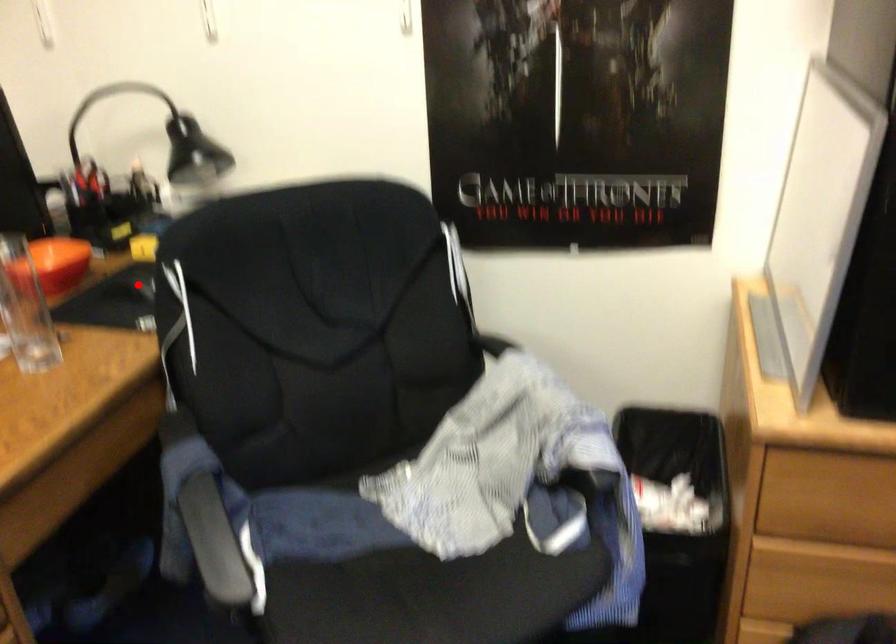
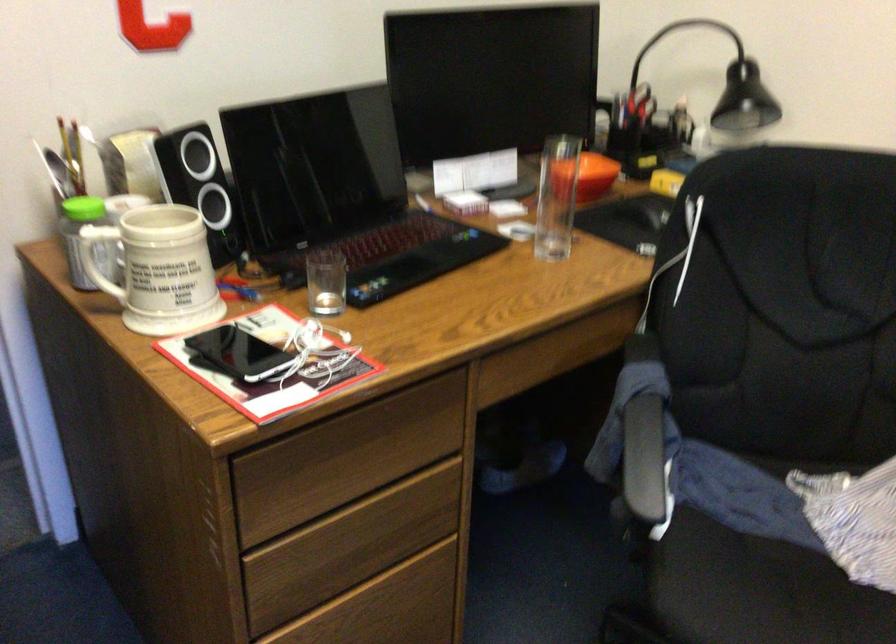
In the second image, find the point that corresponds to the highlighted location in the first image.

(647, 210)